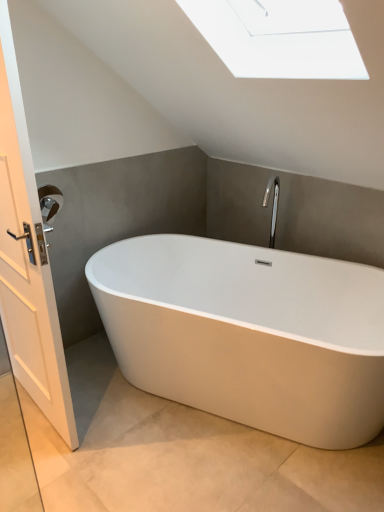
Identify the location of vacant region in front of white wooden door at left. 43,459.